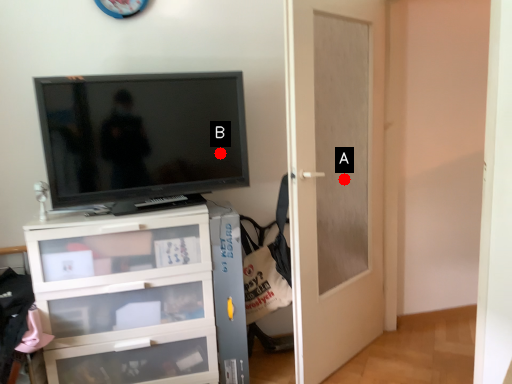
Question: Two points are circled on the image, labeled by A and B beside each circle. Which of the following is the farthest from the observer?

Choices:
 (A) A is further
 (B) B is further

Answer: (A)